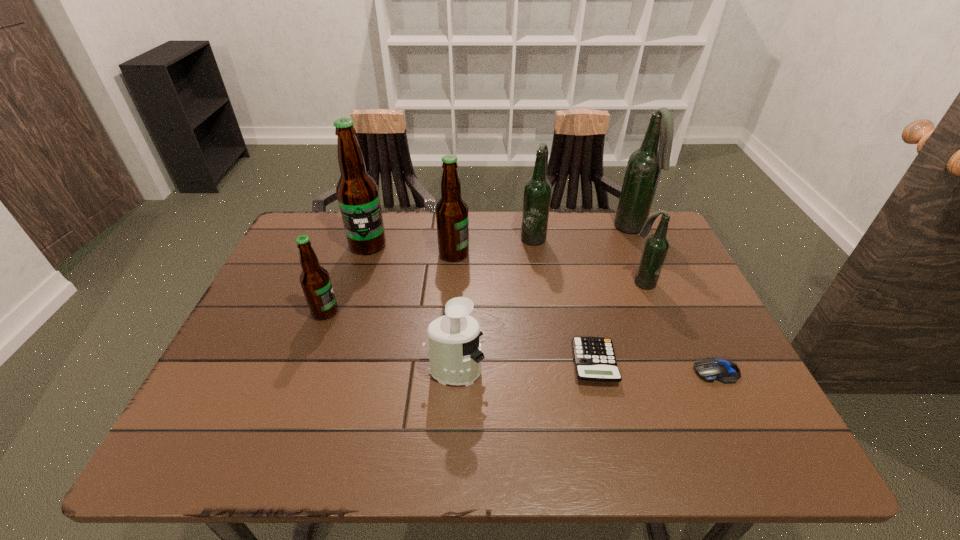
Identify which object is the fourth nearest to the fifth farthest object. Please provide its 2D coordinates. Your answer should be formatted as a tuple, i.e. [(x, y)], where the tuple contains the x and y coordinates of a point satisfying the conditions above.

[(537, 192)]

Identify which object is the closest to the juicer. Please provide its 2D coordinates. Your answer should be formatted as a tuple, i.e. [(x, y)], where the tuple contains the x and y coordinates of a point satisfying the conditions above.

[(594, 357)]

Select which beer bottle appears as the fifth closest to the sixth object from left to right. Please provide its 2D coordinates. Your answer should be formatted as a tuple, i.e. [(x, y)], where the tuple contains the x and y coordinates of a point satisfying the conditions above.

[(315, 281)]

Locate an element on the screen. The width and height of the screenshot is (960, 540). the second closest beer bottle to the computer mouse is located at coordinates (644, 167).

Find the location of a particular element. The width and height of the screenshot is (960, 540). dark beer bottle object that ranks as the third closest to the computer mouse is located at coordinates (537, 192).

Locate which dark beer bottle ranks second in proximity to the nearest beer bottle. Please provide its 2D coordinates. Your answer should be formatted as a tuple, i.e. [(x, y)], where the tuple contains the x and y coordinates of a point satisfying the conditions above.

[(656, 246)]

Point out which brown beer bottle is positioned as the second nearest to the biggest dark beer bottle. Please provide its 2D coordinates. Your answer should be formatted as a tuple, i.e. [(x, y)], where the tuple contains the x and y coordinates of a point satisfying the conditions above.

[(357, 192)]

Locate which brown beer bottle is the third closest to the computer mouse. Please provide its 2D coordinates. Your answer should be formatted as a tuple, i.e. [(x, y)], where the tuple contains the x and y coordinates of a point satisfying the conditions above.

[(357, 192)]

The height and width of the screenshot is (540, 960). Identify the location of free space that satisfies the following two spatial constraints: 1. on the back side of the sixth object from left to right; 2. on the label of the smallest brown beer bottle. (582, 312).

Locate an element on the screen. free space that satisfies the following two spatial constraints: 1. on the label of the fourth object from right to left; 2. on the right side of the biggest brown beer bottle is located at coordinates (331, 363).